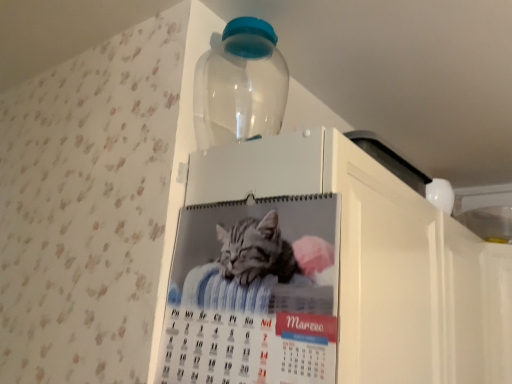
Question: From the image's perspective, is white glossy calendar at upper center located above printed paper calendar at center?

Choices:
 (A) yes
 (B) no

Answer: (B)

Question: Can you see white glossy calendar at upper center touching printed paper calendar at center?

Choices:
 (A) no
 (B) yes

Answer: (B)

Question: Can you confirm if white glossy calendar at upper center is bigger than printed paper calendar at center?

Choices:
 (A) yes
 (B) no

Answer: (A)

Question: Is white glossy calendar at upper center shorter than printed paper calendar at center?

Choices:
 (A) no
 (B) yes

Answer: (A)

Question: Could you tell me if white glossy calendar at upper center is facing printed paper calendar at center?

Choices:
 (A) no
 (B) yes

Answer: (A)

Question: Is printed paper calendar at center inside or outside of white glossy calendar at upper center?

Choices:
 (A) outside
 (B) inside

Answer: (A)

Question: Looking at the image, does printed paper calendar at center seem bigger or smaller compared to white glossy calendar at upper center?

Choices:
 (A) big
 (B) small

Answer: (B)

Question: Considering the relative positions of printed paper calendar at center and white glossy calendar at upper center in the image provided, is printed paper calendar at center to the left or to the right of white glossy calendar at upper center?

Choices:
 (A) left
 (B) right

Answer: (A)

Question: Is printed paper calendar at center taller or shorter than white glossy calendar at upper center?

Choices:
 (A) tall
 (B) short

Answer: (B)

Question: Would you say white glossy calendar at upper center is inside or outside printed paper calendar at center?

Choices:
 (A) inside
 (B) outside

Answer: (B)

Question: From a real-world perspective, is white glossy calendar at upper center positioned above or below printed paper calendar at center?

Choices:
 (A) above
 (B) below

Answer: (B)

Question: Is white glossy calendar at upper center wider or thinner than printed paper calendar at center?

Choices:
 (A) wide
 (B) thin

Answer: (A)

Question: Considering the positions of white glossy calendar at upper center and printed paper calendar at center in the image, is white glossy calendar at upper center bigger or smaller than printed paper calendar at center?

Choices:
 (A) big
 (B) small

Answer: (A)

Question: Does point (261, 81) appear closer or farther from the camera than point (174, 256)?

Choices:
 (A) closer
 (B) farther

Answer: (B)

Question: Considering the positions of transparent plastic bottle at upper center and printed paper calendar at center in the image, is transparent plastic bottle at upper center taller or shorter than printed paper calendar at center?

Choices:
 (A) tall
 (B) short

Answer: (B)